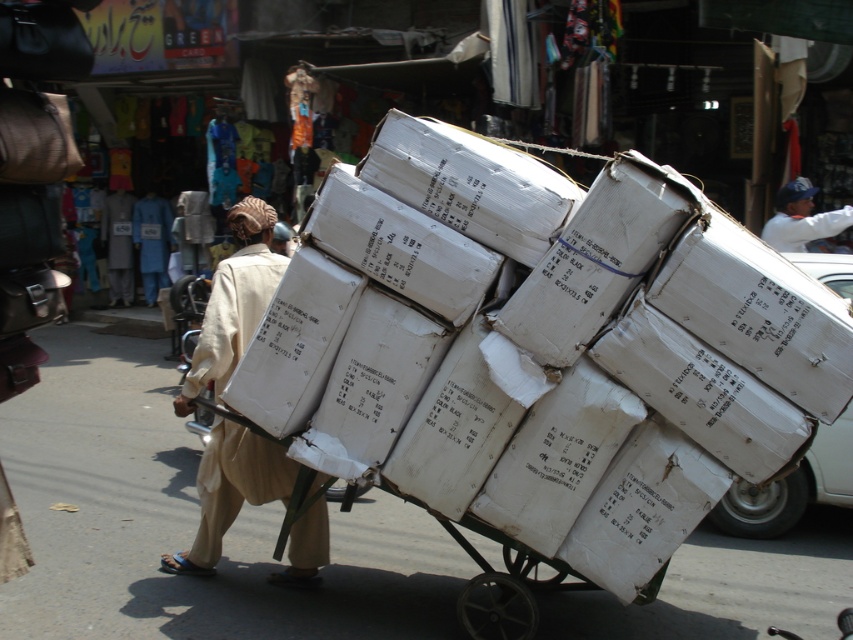
Consider the image. You are a delivery person who needs to deliver the white cardboard boxes at center to a customer. You notice a white cotton shirt at upper right hanging on a nearby rack. To avoid damaging the boxes, which item should you move first?

You should move the white cotton shirt at upper right first because the white cardboard boxes at center are located below it, so moving the shirt first would prevent it from falling onto the boxes during delivery.

You are a pedestrian walking on the street and see the white cardboard boxes at center and the light brown cotton robe at center. Which object is closer to you?

The white cardboard boxes at center are closer to you because they are positioned in front of the light brown cotton robe at center.